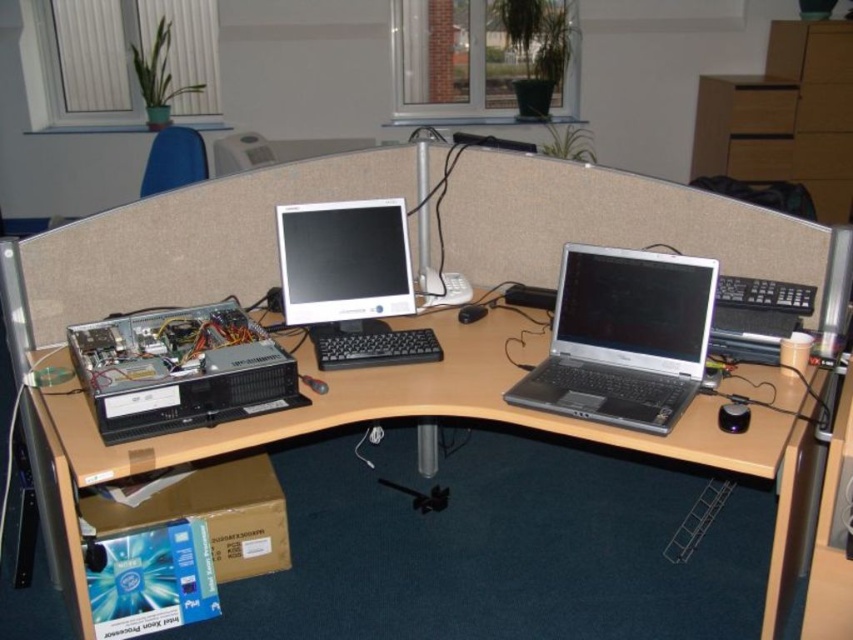
You are setting up a new desk arrangement and need to place both the black plastic desktop computer at lower left and the satin black monitor at center. Given their sizes, which one should be placed first to ensure proper positioning?

The black plastic desktop computer at lower left is larger in size than the satin black monitor at center, so it should be placed first to accommodate its larger footprint before positioning the monitor.